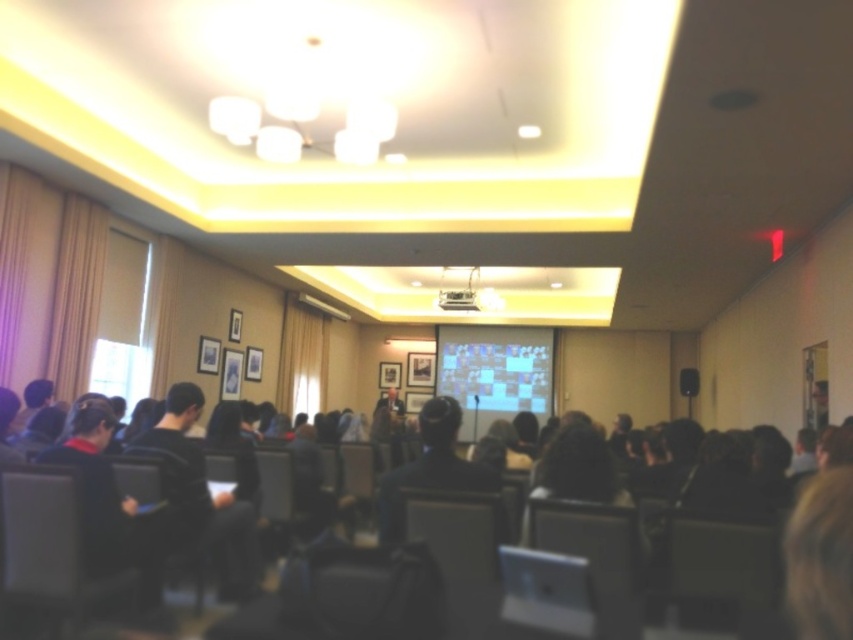
Image resolution: width=853 pixels, height=640 pixels. Find the location of `matte gray chair at lower left`. matte gray chair at lower left is located at coordinates (49, 548).

Between matte white projection screen at center and white plastic projector at upper center, which one appears on the left side from the viewer's perspective?

white plastic projector at upper center is more to the left.

Is matte white projection screen at center in front of white plastic projector at upper center?

No, it is not.

Between point (511, 413) and point (474, 300), which one is positioned behind?

The point (511, 413) is more distant.

Identify the location of matte white projection screen at center. The height and width of the screenshot is (640, 853). (495, 368).

Can you confirm if matte gray chair at lower left is smaller than matte white projection screen at center?

Indeed, matte gray chair at lower left has a smaller size compared to matte white projection screen at center.

Is matte gray chair at lower left shorter than matte white projection screen at center?

Yes, matte gray chair at lower left is shorter than matte white projection screen at center.

Find the location of a particular element. matte gray chair at lower left is located at coordinates (49, 548).

Where is `matte gray chair at lower left`? matte gray chair at lower left is located at coordinates (49, 548).